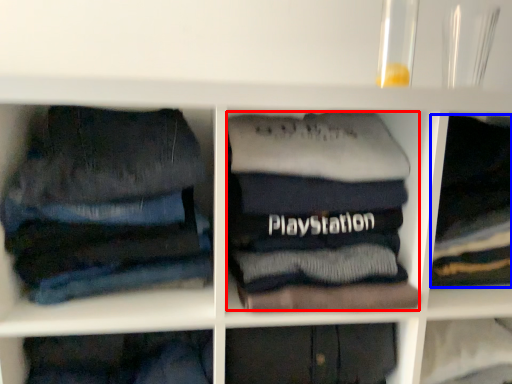
Question: Which object is further to the camera taking this photo, clothing (highlighted by a red box) or clothing (highlighted by a blue box)?

Choices:
 (A) clothing
 (B) clothing

Answer: (B)